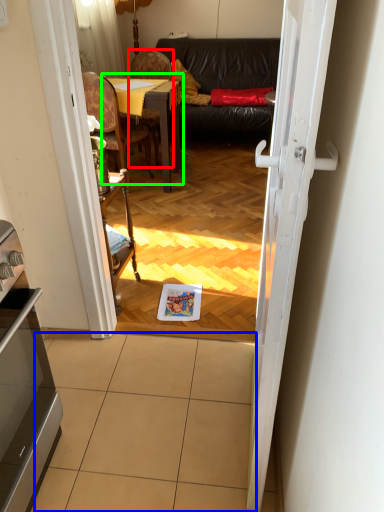
Question: Which is farther away from chair (highlighted by a red box)? tile (highlighted by a blue box) or table (highlighted by a green box)?

Choices:
 (A) tile
 (B) table

Answer: (A)